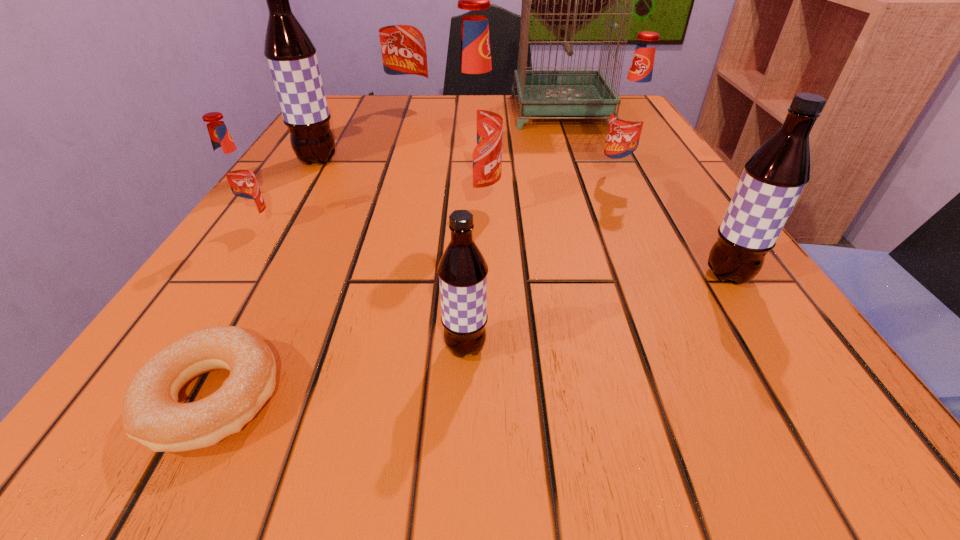
The image size is (960, 540). I want to click on free spot that satisfies the following two spatial constraints: 1. on the back side of the tallest root beer; 2. on the left side of the biggest brown root beer, so click(x=347, y=112).

I want to click on vacant space that satisfies the following two spatial constraints: 1. on the front side of the nearest brown root beer; 2. on the right side of the biggest red root beer, so (335, 348).

At what (x,y) coordinates should I click in order to perform the action: click on free space in the image that satisfies the following two spatial constraints: 1. on the back side of the smallest brown root beer; 2. on the left side of the shortest object. Please return your answer as a coordinate pair (x, y). Image resolution: width=960 pixels, height=540 pixels. Looking at the image, I should click on (240, 348).

Find the location of a particular element. This screenshot has width=960, height=540. vacant point that satisfies the following two spatial constraints: 1. at the door of the third nearest red root beer; 2. on the left side of the birdcage is located at coordinates (586, 178).